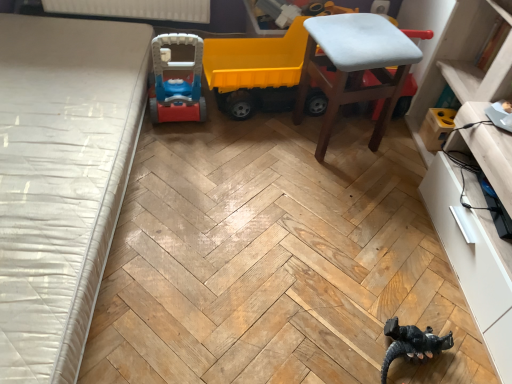
I want to click on black matte toy dinosaur at lower right, so click(412, 344).

This screenshot has width=512, height=384. I want to click on light blue fabric stool at upper right, so click(354, 67).

This screenshot has width=512, height=384. Describe the element at coordinates (61, 180) in the screenshot. I see `white textured mattress at left` at that location.

Find the location of a particular element. The width and height of the screenshot is (512, 384). yellow plastic toy truck at center is located at coordinates (253, 67).

This screenshot has height=384, width=512. I want to click on dresser above the white textured mattress at left (from a real-world perspective), so click(x=474, y=259).

Visually, is white glossy dresser at lower right positioned to the left or to the right of white textured mattress at left?

Based on their positions, white glossy dresser at lower right is located to the right of white textured mattress at left.

Is white glossy dresser at lower right touching white textured mattress at left?

white glossy dresser at lower right and white textured mattress at left are not in contact.

Which is closer to the camera, (x=422, y=81) or (x=6, y=264)?

Clearly, point (x=422, y=81) is more distant from the camera than point (x=6, y=264).

Is point (18, 23) less distant than point (250, 83)?

That is False.

Considering the relative sizes of white textured mattress at left and yellow plastic toy truck at center in the image provided, is white textured mattress at left wider than yellow plastic toy truck at center?

Yes, white textured mattress at left is wider than yellow plastic toy truck at center.

Is white textured mattress at left far away from yellow plastic toy truck at center?

They are positioned close to each other.

Looking at this image, does white textured mattress at left have a greater height compared to yellow plastic toy truck at center?

Incorrect, the height of white textured mattress at left is not larger of that of yellow plastic toy truck at center.

Based on their sizes in the image, would you say black matte toy dinosaur at lower right is bigger or smaller than white glossy dresser at lower right?

black matte toy dinosaur at lower right is smaller than white glossy dresser at lower right.

Is black matte toy dinosaur at lower right facing towards white glossy dresser at lower right?

No, black matte toy dinosaur at lower right is not facing towards white glossy dresser at lower right.

How distant is black matte toy dinosaur at lower right from white glossy dresser at lower right?

black matte toy dinosaur at lower right is 53.24 centimeters from white glossy dresser at lower right.

Find the location of a particular element. The height and width of the screenshot is (384, 512). toy on the left of white glossy dresser at lower right is located at coordinates (412, 344).

Considering the points (410, 110) and (342, 49), which point is behind, point (410, 110) or point (342, 49)?

The point (410, 110) is behind.

Is white glossy dresser at lower right beside light blue fabric stool at upper right?

No, white glossy dresser at lower right is not touching light blue fabric stool at upper right.

Considering the relative sizes of white glossy dresser at lower right and light blue fabric stool at upper right in the image provided, is white glossy dresser at lower right shorter than light blue fabric stool at upper right?

Correct, white glossy dresser at lower right is not as tall as light blue fabric stool at upper right.

Between white glossy dresser at lower right and light blue fabric stool at upper right, which one has smaller size?

light blue fabric stool at upper right is smaller.

In terms of width, does yellow plastic toy truck at center look wider or thinner when compared to light blue fabric stool at upper right?

Considering their sizes, yellow plastic toy truck at center looks slimmer than light blue fabric stool at upper right.

Considering the positions of objects yellow plastic toy truck at center and light blue fabric stool at upper right in the image provided, who is in front, yellow plastic toy truck at center or light blue fabric stool at upper right?

light blue fabric stool at upper right is in front.

Can you tell me how much yellow plastic toy truck at center and light blue fabric stool at upper right differ in facing direction?

There is a 6.01-degree angle between the facing directions of yellow plastic toy truck at center and light blue fabric stool at upper right.

Does point (306, 37) come in front of point (356, 39)?

That is False.

Which is further, (x=402, y=340) or (x=123, y=91)?

Positioned behind is point (x=123, y=91).

From the image's perspective, which object appears higher, black matte toy dinosaur at lower right or white textured mattress at left?

white textured mattress at left appears higher in the image.

Considering the sizes of black matte toy dinosaur at lower right and white textured mattress at left in the image, is black matte toy dinosaur at lower right bigger or smaller than white textured mattress at left?

In the image, black matte toy dinosaur at lower right appears to be smaller than white textured mattress at left.

Is white textured mattress at left a part of black matte toy dinosaur at lower right?

Definitely not — white textured mattress at left is not inside black matte toy dinosaur at lower right.

Does white textured mattress at left touch light blue fabric stool at upper right?

No, white textured mattress at left is not beside light blue fabric stool at upper right.

Looking at this image, from a real-world perspective, is white textured mattress at left physically above light blue fabric stool at upper right?

No, from a real-world perspective, white textured mattress at left is not on top of light blue fabric stool at upper right.

Where is `bed below the white glossy dresser at lower right (from a real-world perspective)`? The height and width of the screenshot is (384, 512). bed below the white glossy dresser at lower right (from a real-world perspective) is located at coordinates (61, 180).

Identify the location of bed in front of the yellow plastic toy truck at center. The width and height of the screenshot is (512, 384). (61, 180).

Which object lies nearer to the anchor point black matte toy dinosaur at lower right, white glossy dresser at lower right or light blue fabric stool at upper right?

white glossy dresser at lower right.

Based on their spatial positions, is yellow plastic toy truck at center or white glossy dresser at lower right further from light blue fabric stool at upper right?

white glossy dresser at lower right lies further to light blue fabric stool at upper right than the other object.

When comparing their distances from black matte toy dinosaur at lower right, does light blue fabric stool at upper right or white glossy dresser at lower right seem further?

light blue fabric stool at upper right is positioned further to the anchor black matte toy dinosaur at lower right.

Looking at the image, which one is located further to black matte toy dinosaur at lower right, yellow plastic toy truck at center or light blue fabric stool at upper right?

Answer: yellow plastic toy truck at center is positioned further to the anchor black matte toy dinosaur at lower right.

From the image, which object appears to be nearer to black matte toy dinosaur at lower right, white textured mattress at left or white glossy dresser at lower right?

white glossy dresser at lower right is closer to black matte toy dinosaur at lower right.

Considering their positions, is light blue fabric stool at upper right positioned closer to yellow plastic toy truck at center than black matte toy dinosaur at lower right?

light blue fabric stool at upper right is closer to yellow plastic toy truck at center.

From the image, which object appears to be nearer to white textured mattress at left, yellow plastic toy truck at center or light blue fabric stool at upper right?

Among the two, yellow plastic toy truck at center is located nearer to white textured mattress at left.

Based on their spatial positions, is black matte toy dinosaur at lower right or light blue fabric stool at upper right closer to white textured mattress at left?

light blue fabric stool at upper right.

Image resolution: width=512 pixels, height=384 pixels. I want to click on model car situated between white textured mattress at left and light blue fabric stool at upper right from left to right, so click(253, 67).

Image resolution: width=512 pixels, height=384 pixels. I want to click on model car between white textured mattress at left and black matte toy dinosaur at lower right from left to right, so click(253, 67).

I want to click on chair between white textured mattress at left and black matte toy dinosaur at lower right, so click(x=354, y=67).

I want to click on chair between yellow plastic toy truck at center and black matte toy dinosaur at lower right in the up-down direction, so click(x=354, y=67).